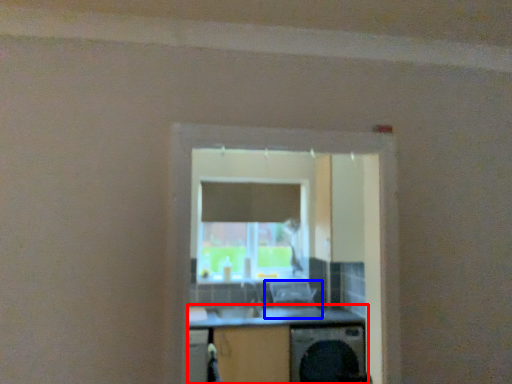
Question: Which point is closer to the camera, computer desk (highlighted by a red box) or computer chair (highlighted by a blue box)?

Choices:
 (A) computer desk
 (B) computer chair

Answer: (A)